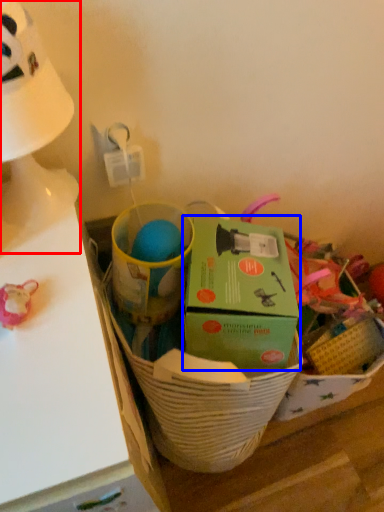
Question: Which point is closer to the camera, table lamp (highlighted by a red box) or box (highlighted by a blue box)?

Choices:
 (A) table lamp
 (B) box

Answer: (A)